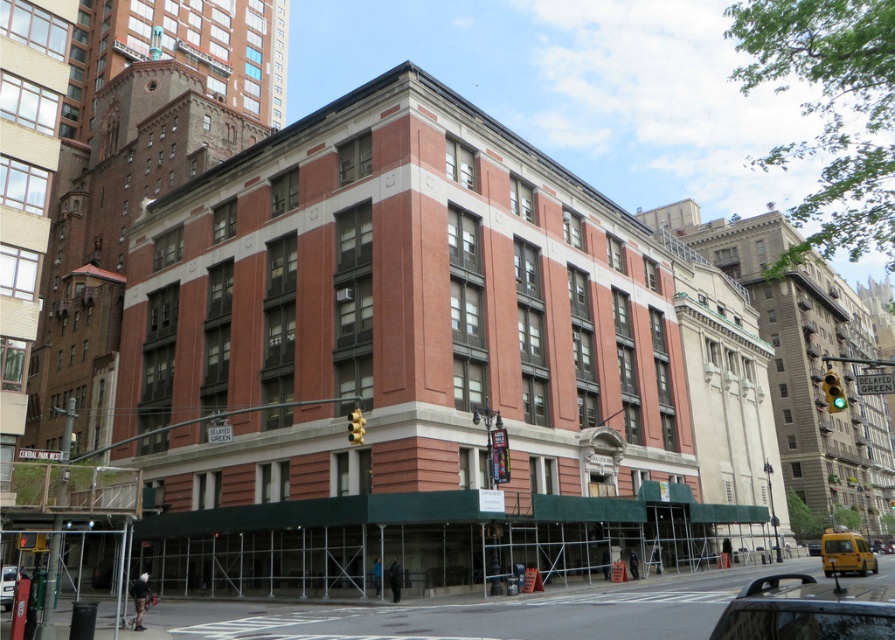
Question: Which is nearer to the shiny black car at lower right?

Choices:
 (A) metallic silver car at lower left
 (B) yellow matte van at lower right

Answer: (B)

Question: From the image, what is the correct spatial relationship of yellow matte van at lower right in relation to metallic silver car at lower left?

Choices:
 (A) below
 (B) above

Answer: (A)

Question: Does shiny black car at lower right lie in front of yellow matte van at lower right?

Choices:
 (A) yes
 (B) no

Answer: (A)

Question: Which object is closer to the camera taking this photo?

Choices:
 (A) yellow matte van at lower right
 (B) shiny black car at lower right
 (C) metallic silver car at lower left

Answer: (B)

Question: Where is shiny black car at lower right located in relation to yellow matte van at lower right in the image?

Choices:
 (A) right
 (B) left

Answer: (B)

Question: Which of the following is the closest to the observer?

Choices:
 (A) (1, 572)
 (B) (871, 556)

Answer: (A)